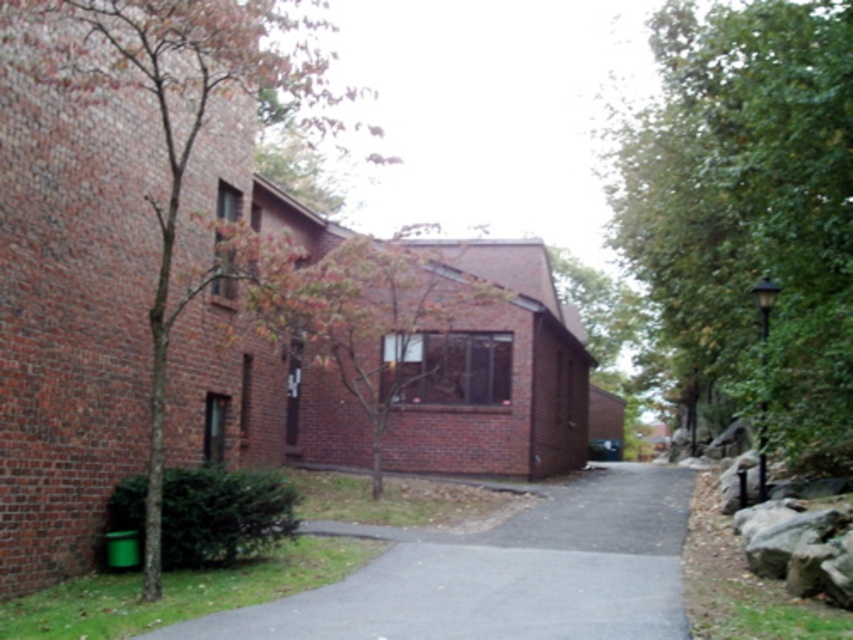
You are standing at the start of the pathway and want to walk towards the brick building. Which tree, the green leafy tree at right or the brown textured tree at left, will you pass closer to as you walk towards the building?

The green leafy tree at right is to the right of brown textured tree at left. Since you are walking towards the brick building located on the left side of the frame, you will pass closer to the brown textured tree at left first before reaching the green leafy tree at right.